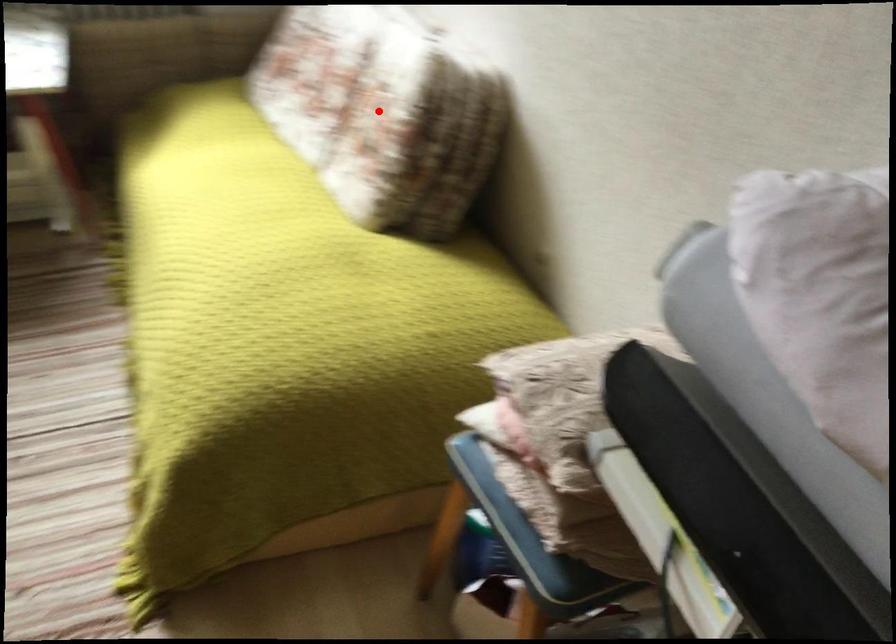
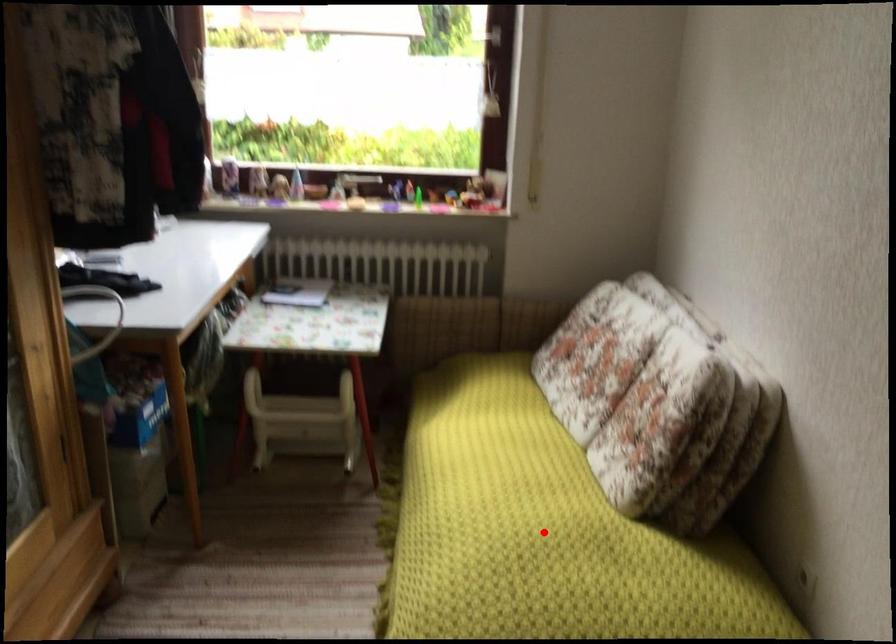
I am providing you with two images of the same scene from different viewpoints. A red point is marked on the first image and another point is marked on the second image. Do the highlighted points in image1 and image2 indicate the same real-world spot?

No